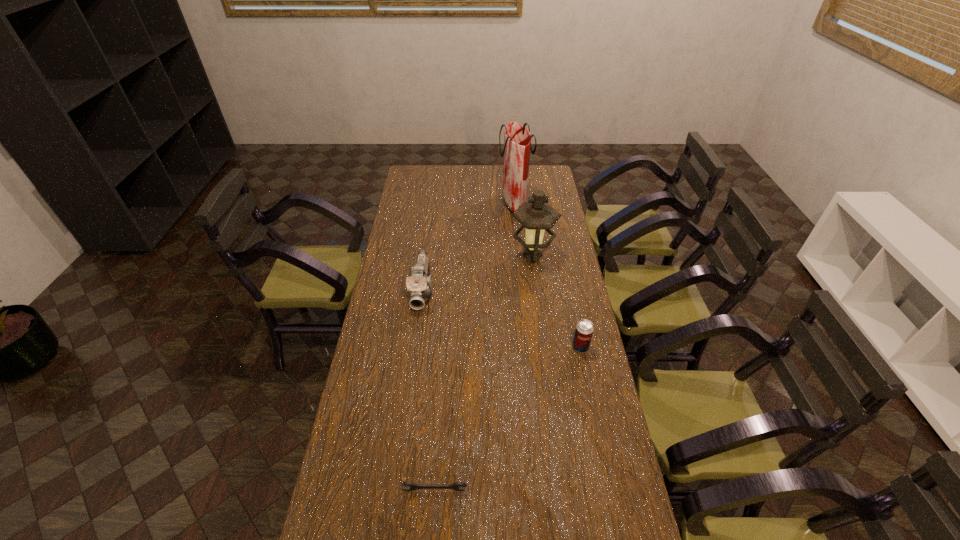
Image resolution: width=960 pixels, height=540 pixels. I want to click on vacant area at the right edge, so click(544, 303).

Image resolution: width=960 pixels, height=540 pixels. I want to click on vacant area between the grocery bag and the second nearest object, so click(x=547, y=275).

Where is `free space between the nearest object and the second shortest object`? The image size is (960, 540). free space between the nearest object and the second shortest object is located at coordinates (507, 418).

The width and height of the screenshot is (960, 540). In order to click on vacant space in between the farthest object and the second shortest object in this screenshot , I will do `click(547, 275)`.

You are a GUI agent. You are given a task and a screenshot of the screen. Output one action in this format:
    pyautogui.click(x=<x>, y=<y>)
    Task: Click on the free space between the shortest object and the farthest object
    The height and width of the screenshot is (540, 960).
    Given the screenshot: What is the action you would take?
    pyautogui.click(x=474, y=347)

Find the location of a particular element. The image size is (960, 540). vacant region between the third farthest object and the oil lamp is located at coordinates (477, 273).

Where is `vacant space that is in between the fourth nearest object and the farthest object`? The width and height of the screenshot is (960, 540). vacant space that is in between the fourth nearest object and the farthest object is located at coordinates (523, 230).

Find the location of a particular element. The image size is (960, 540). blank region between the third farthest object and the oil lamp is located at coordinates (477, 273).

Where is `vacant space that is in between the third tallest object and the grocery bag`? This screenshot has width=960, height=540. vacant space that is in between the third tallest object and the grocery bag is located at coordinates (468, 247).

Locate an element on the screen. The image size is (960, 540). free space between the grocery bag and the second shortest object is located at coordinates (547, 275).